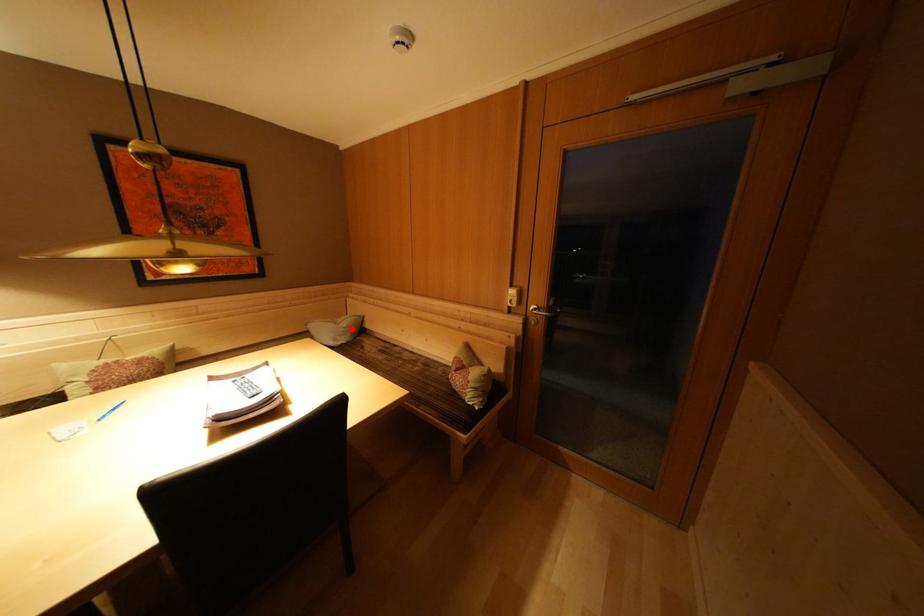
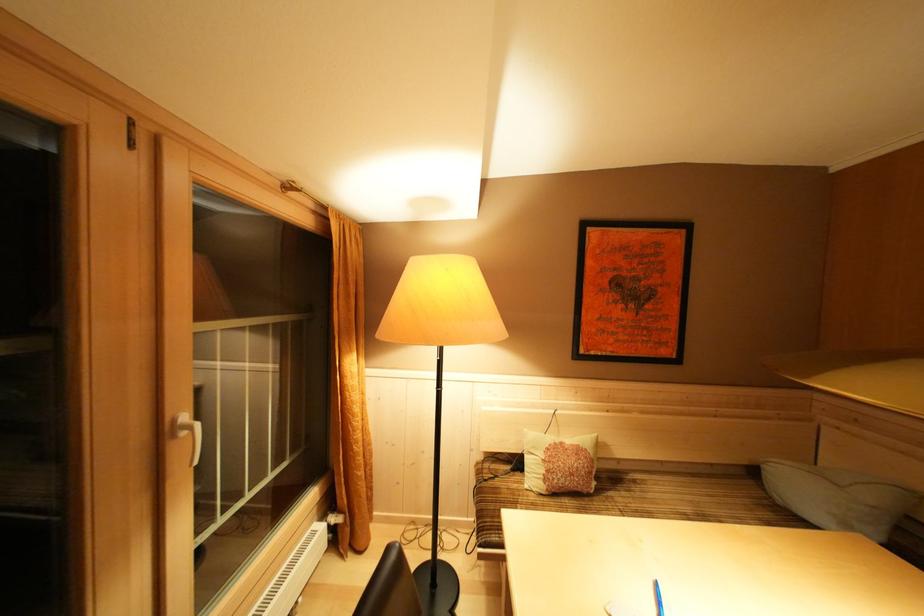
Locate, in the second image, the point that corresponds to the highlighted location in the first image.

(879, 503)